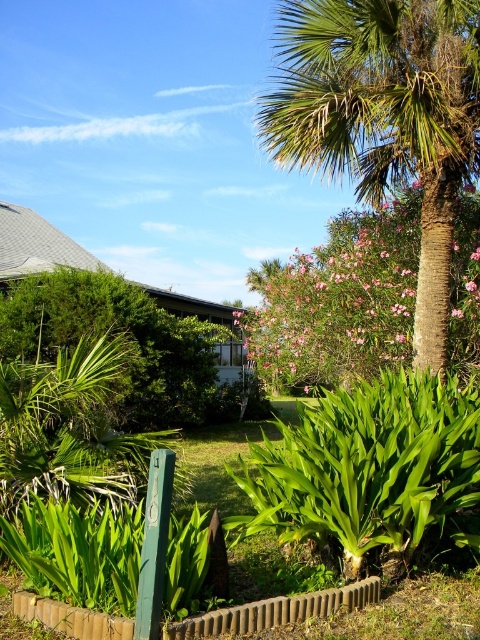
What do you see at coordinates (384, 116) in the screenshot? I see `green textured palm tree at upper right` at bounding box center [384, 116].

What do you see at coordinates (384, 116) in the screenshot?
I see `green textured palm tree at upper right` at bounding box center [384, 116].

What are the coordinates of `green textured palm tree at upper right` in the screenshot? It's located at (384, 116).

Between point (418, 102) and point (36, 353), which one is positioned in front?

Positioned in front is point (418, 102).

Which is in front, point (476, 93) or point (225, 413)?

Positioned in front is point (476, 93).

The height and width of the screenshot is (640, 480). Identify the location of green textured palm tree at upper right. (384, 116).

Is point (206, 403) positioned after point (179, 627)?

Yes, it is.

Is point (193, 333) less distant than point (282, 608)?

No.

Find the location of a particular element. This screenshot has height=640, width=480. green leafy bush at center is located at coordinates (119, 332).